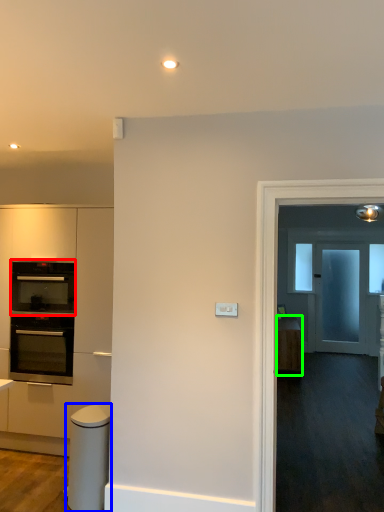
Question: Which object is the farthest from oven (highlighted by a red box)? Choose among these: appliance (highlighted by a blue box) or cabinetry (highlighted by a green box).

Choices:
 (A) appliance
 (B) cabinetry

Answer: (B)